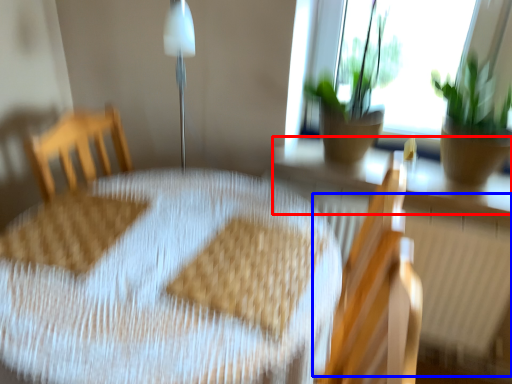
Question: Which point is further to the camera, window sill (highlighted by a red box) or radiator (highlighted by a blue box)?

Choices:
 (A) window sill
 (B) radiator

Answer: (A)